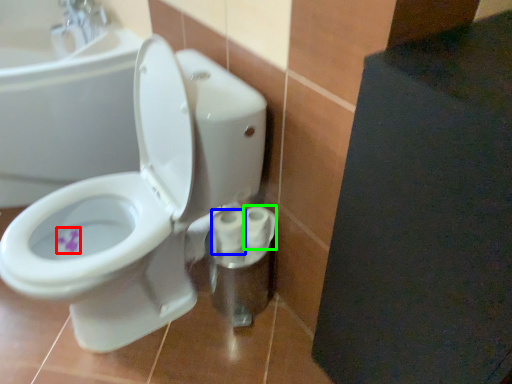
Question: Considering the real-world distances, which object is closest to flower (highlighted by a red box)? toilet paper (highlighted by a blue box) or toilet paper (highlighted by a green box).

Choices:
 (A) toilet paper
 (B) toilet paper

Answer: (A)